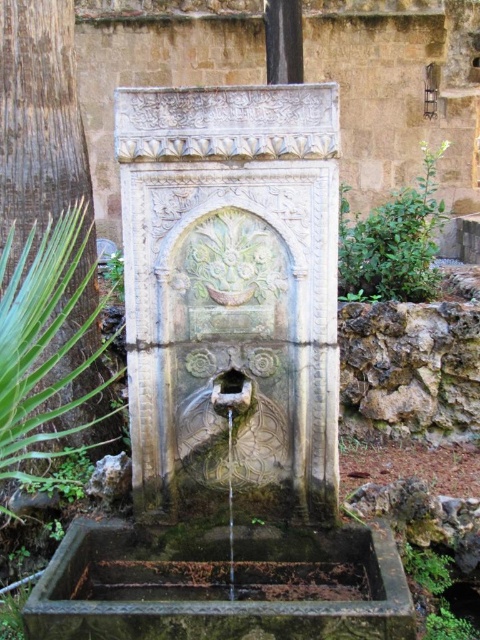
Question: Does carved stone fountain at center appear over clear glass water at center?

Choices:
 (A) no
 (B) yes

Answer: (B)

Question: Is carved stone fountain at center thinner than clear glass water at center?

Choices:
 (A) yes
 (B) no

Answer: (B)

Question: Among these points, which one is nearest to the camera?

Choices:
 (A) (232, 547)
 (B) (195, 250)

Answer: (B)

Question: Which object is closer to the camera taking this photo?

Choices:
 (A) clear glass water at center
 (B) carved stone fountain at center

Answer: (B)

Question: From the image, what is the correct spatial relationship of carved stone fountain at center in relation to clear glass water at center?

Choices:
 (A) left
 (B) right

Answer: (A)